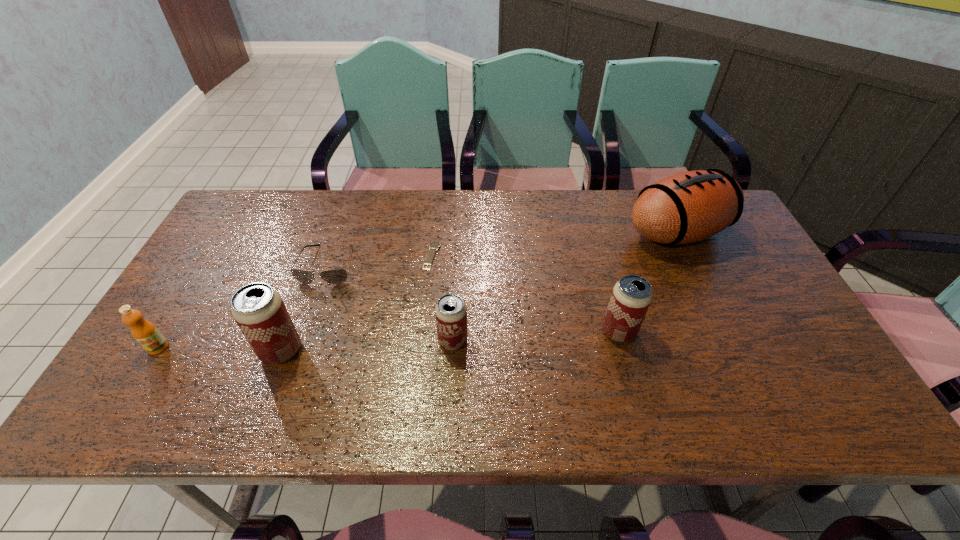
You are a GUI agent. You are given a task and a screenshot of the screen. Output one action in this format:
    pyautogui.click(x=<x>, y=<y>)
    Task: Click on the vacant area situated 0.270m on the back of the leftmost beer can
    The image size is (960, 540).
    Given the screenshot: What is the action you would take?
    click(x=316, y=258)

Find the location of a particular element. The width and height of the screenshot is (960, 540). vacant point located on the left of the second beer can from right to left is located at coordinates (380, 341).

Locate an element on the screen. The image size is (960, 540). vacant region located 0.380m on the back of the sixth object from left to right is located at coordinates (589, 223).

Locate an element on the screen. The width and height of the screenshot is (960, 540). free location located 0.210m on the back of the fourth object from right to left is located at coordinates (438, 200).

Find the location of `vacant area situated on the left of the rightmost object`. vacant area situated on the left of the rightmost object is located at coordinates (507, 233).

Locate an element on the screen. The height and width of the screenshot is (540, 960). free location located on the front-facing side of the sunglasses is located at coordinates [315, 303].

This screenshot has width=960, height=540. I want to click on vacant area situated 0.050m on the front label of the orange juice, so click(142, 374).

This screenshot has height=540, width=960. In order to click on object that is at the far edge in this screenshot , I will do `click(687, 207)`.

What are the coordinates of `beer can present at the near edge` in the screenshot? It's located at (259, 311).

Locate an element on the screen. orange juice that is at the near edge is located at coordinates pyautogui.click(x=146, y=334).